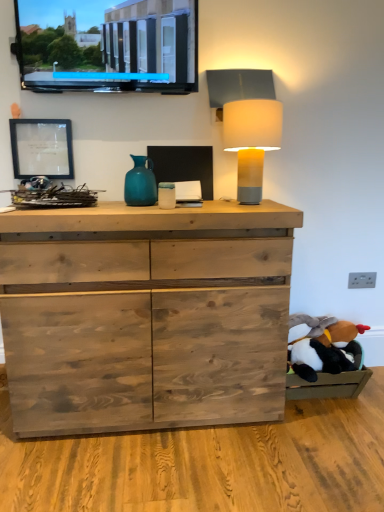
Image resolution: width=384 pixels, height=512 pixels. I want to click on free region on the left part of matte yellow lampshade at upper right, so click(203, 202).